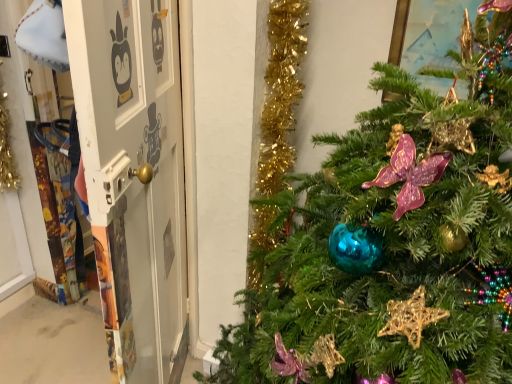
I want to click on white glossy door at center, so click(x=134, y=177).

Measure the distance between point [154,110] and camera.

Point [154,110] and camera are 4.72 feet apart.

What do you see at coordinates (134, 177) in the screenshot? This screenshot has height=384, width=512. I see `white glossy door at center` at bounding box center [134, 177].

Describe the element at coordinates (393, 244) in the screenshot. This screenshot has width=512, height=384. I see `shiny teal ornament at center` at that location.

What is the approximate width of shiny teal ornament at center?

The width of shiny teal ornament at center is 14.61 inches.

This screenshot has width=512, height=384. I want to click on shiny teal ornament at center, so click(393, 244).

In order to face shiny teal ornament at center, should I rotate leftwards or rightwards?

It's best to rotate right around 19.805 degrees.

Where is `white glossy door at center`? The width and height of the screenshot is (512, 384). white glossy door at center is located at coordinates (134, 177).

Is shiny teal ornament at center to the left or to the right of white glossy door at center in the image?

In the image, shiny teal ornament at center appears on the right side of white glossy door at center.

Is shiny teal ornament at center behind white glossy door at center?

No.

Between point (421, 165) and point (162, 81), which one is positioned in front?

The point (421, 165) is in front.

From the picture: From the image's perspective, is shiny teal ornament at center under white glossy door at center?

Yes, from the image's perspective, shiny teal ornament at center is beneath white glossy door at center.

From a real-world perspective, is shiny teal ornament at center on top of white glossy door at center?

Correct, in the physical world, shiny teal ornament at center is higher than white glossy door at center.

Considering the sizes of objects shiny teal ornament at center and white glossy door at center in the image provided, who is thinner, shiny teal ornament at center or white glossy door at center?

white glossy door at center.

Can you confirm if shiny teal ornament at center is shorter than white glossy door at center?

No, shiny teal ornament at center is not shorter than white glossy door at center.

Considering the relative sizes of shiny teal ornament at center and white glossy door at center in the image provided, is shiny teal ornament at center smaller than white glossy door at center?

Incorrect, shiny teal ornament at center is not smaller in size than white glossy door at center.

Which is correct: shiny teal ornament at center is inside white glossy door at center, or outside of it?

shiny teal ornament at center lies outside white glossy door at center.

Looking at this image, is shiny teal ornament at center beside white glossy door at center?

No, shiny teal ornament at center is not touching white glossy door at center.

Looking at this image, is white glossy door at center at the back of shiny teal ornament at center?

That's not correct — shiny teal ornament at center is not looking away from white glossy door at center.

You are a GUI agent. You are given a task and a screenshot of the screen. Output one action in this format:
    pyautogui.click(x=<x>, y=<y>)
    Task: Click on the screen door that is under the shiny teal ornament at center (from a real-world perspective)
    
    Given the screenshot: What is the action you would take?
    pyautogui.click(x=134, y=177)

Visually, is white glossy door at center positioned to the left or to the right of shiny teal ornament at center?

From the image, it's evident that white glossy door at center is to the left of shiny teal ornament at center.

In the scene shown: Considering the positions of objects white glossy door at center and shiny teal ornament at center in the image provided, who is behind, white glossy door at center or shiny teal ornament at center?

white glossy door at center is further away from the camera.

Is point (129, 107) less distant than point (409, 150)?

No.

From the image's perspective, would you say white glossy door at center is positioned over shiny teal ornament at center?

Indeed, from the image's perspective, white glossy door at center is shown above shiny teal ornament at center.

From a real-world perspective, which object rests below the other?

white glossy door at center, from a real-world perspective.

Can you confirm if white glossy door at center is wider than shiny teal ornament at center?

Incorrect, the width of white glossy door at center does not surpass that of shiny teal ornament at center.

Considering the relative sizes of white glossy door at center and shiny teal ornament at center in the image provided, is white glossy door at center taller than shiny teal ornament at center?

Incorrect, the height of white glossy door at center is not larger of that of shiny teal ornament at center.

Considering the sizes of objects white glossy door at center and shiny teal ornament at center in the image provided, who is smaller, white glossy door at center or shiny teal ornament at center?

Smaller between the two is white glossy door at center.

Is white glossy door at center situated inside shiny teal ornament at center or outside?

white glossy door at center is spatially situated outside shiny teal ornament at center.

Is white glossy door at center in contact with shiny teal ornament at center?

white glossy door at center and shiny teal ornament at center are not in contact.

Is white glossy door at center oriented away from shiny teal ornament at center?

white glossy door at center is not turned away from shiny teal ornament at center.

Where is `christmas tree in front of the white glossy door at center`? The width and height of the screenshot is (512, 384). christmas tree in front of the white glossy door at center is located at coordinates (393, 244).

Identify the location of screen door to the left of shiny teal ornament at center. (134, 177).

Where is `screen door behind the shiny teal ornament at center`? Image resolution: width=512 pixels, height=384 pixels. screen door behind the shiny teal ornament at center is located at coordinates (134, 177).